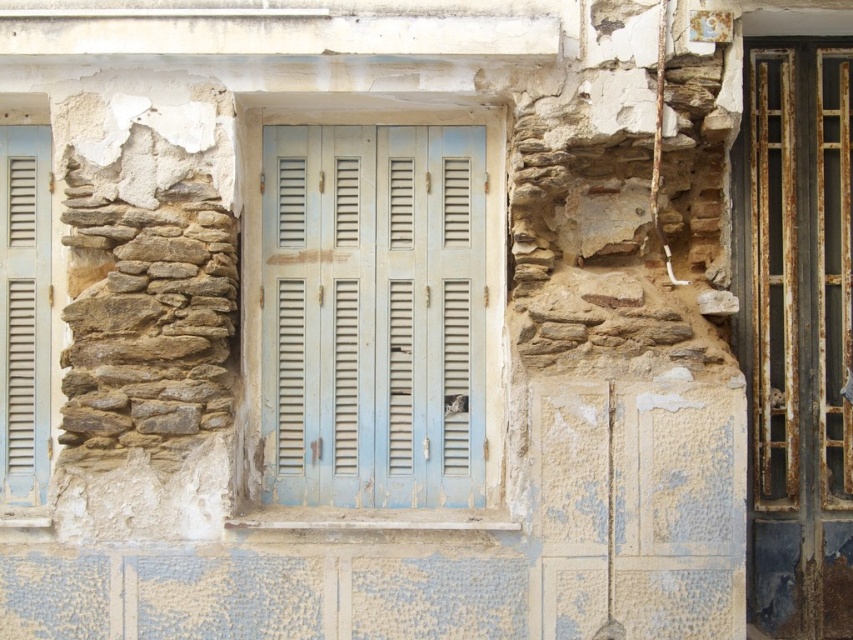
Question: Does light blue wooden shutters at center lie in front of matte blue shutters at left?

Choices:
 (A) yes
 (B) no

Answer: (A)

Question: Does light blue wooden shutters at center lie in front of matte blue shutters at left?

Choices:
 (A) no
 (B) yes

Answer: (B)

Question: Can you confirm if light blue wooden shutters at center is wider than matte blue shutters at left?

Choices:
 (A) yes
 (B) no

Answer: (A)

Question: Which point is farther to the camera?

Choices:
 (A) (x=41, y=486)
 (B) (x=276, y=173)

Answer: (A)